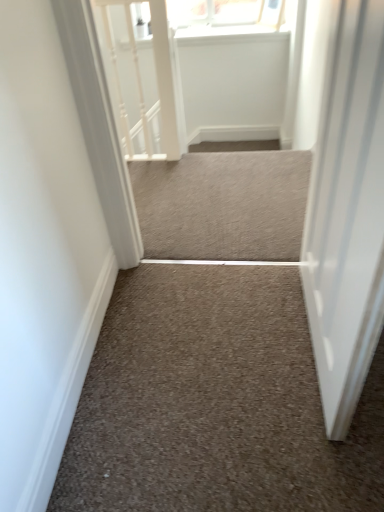
Question: Does neutral carpet at center, arranged as the second stairwell when viewed from the front, have a greater width compared to neutral carpet at center, which appears as the 2th stairwell when viewed from the back?

Choices:
 (A) yes
 (B) no

Answer: (A)

Question: Would you consider neutral carpet at center, arranged as the second stairwell when viewed from the front, to be distant from neutral carpet at center, the 1th stairwell viewed from the front?

Choices:
 (A) yes
 (B) no

Answer: (B)

Question: From a real-world perspective, is neutral carpet at center, arranged as the second stairwell when viewed from the front, beneath neutral carpet at center, the 1th stairwell viewed from the front?

Choices:
 (A) yes
 (B) no

Answer: (B)

Question: Can you confirm if neutral carpet at center, which is the 1th stairwell from back to front, is positioned to the left of neutral carpet at center, the 1th stairwell viewed from the front?

Choices:
 (A) yes
 (B) no

Answer: (A)

Question: Could you tell me if neutral carpet at center, the first stairwell when ordered from top to bottom, is facing neutral carpet at center, the 1th stairwell viewed from the front?

Choices:
 (A) no
 (B) yes

Answer: (A)

Question: Is neutral carpet at center, the first stairwell when ordered from top to bottom, to the left or to the right of neutral carpet at center, the 1th stairwell in the bottom-to-top sequence, in the image?

Choices:
 (A) left
 (B) right

Answer: (A)

Question: Relative to neutral carpet at center, the second stairwell positioned from the top, is neutral carpet at center, the first stairwell when ordered from top to bottom, in front or behind?

Choices:
 (A) behind
 (B) front

Answer: (A)

Question: In terms of width, does neutral carpet at center, which ranks as the 2th stairwell in bottom-to-top order, look wider or thinner when compared to neutral carpet at center, which appears as the 2th stairwell when viewed from the back?

Choices:
 (A) thin
 (B) wide

Answer: (B)

Question: From a real-world perspective, is neutral carpet at center, the first stairwell when ordered from top to bottom, above or below neutral carpet at center, which appears as the 2th stairwell when viewed from the back?

Choices:
 (A) above
 (B) below

Answer: (A)

Question: Considering the positions of neutral carpet at center, which is the 1th stairwell from back to front, and white textured rail at upper left in the image, is neutral carpet at center, which is the 1th stairwell from back to front, wider or thinner than white textured rail at upper left?

Choices:
 (A) wide
 (B) thin

Answer: (A)

Question: From the image's perspective, is neutral carpet at center, arranged as the second stairwell when viewed from the front, above or below white textured rail at upper left?

Choices:
 (A) above
 (B) below

Answer: (B)

Question: Visually, is neutral carpet at center, which is the 1th stairwell from back to front, positioned to the left or to the right of white textured rail at upper left?

Choices:
 (A) right
 (B) left

Answer: (A)

Question: Considering the positions of neutral carpet at center, arranged as the second stairwell when viewed from the front, and white textured rail at upper left in the image, is neutral carpet at center, arranged as the second stairwell when viewed from the front, taller or shorter than white textured rail at upper left?

Choices:
 (A) tall
 (B) short

Answer: (B)

Question: In the image, is white glossy door at right positioned in front of or behind neutral carpet at center, which appears as the 2th stairwell when viewed from the back?

Choices:
 (A) front
 (B) behind

Answer: (A)

Question: From the image's perspective, is white glossy door at right above or below neutral carpet at center, which appears as the 2th stairwell when viewed from the back?

Choices:
 (A) below
 (B) above

Answer: (B)